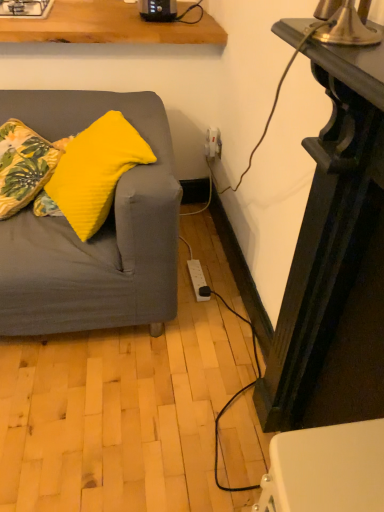
Question: Does yellow fabric pillow at left, marked as the 2th pillow in a right-to-left arrangement, have a greater width compared to yellow fabric pillow at left, the 1th pillow when ordered from right to left?

Choices:
 (A) yes
 (B) no

Answer: (B)

Question: Is yellow fabric pillow at left, marked as the 2th pillow in a right-to-left arrangement, next to yellow fabric pillow at left, the 1th pillow when ordered from right to left, and touching it?

Choices:
 (A) yes
 (B) no

Answer: (B)

Question: Considering the relative sizes of yellow fabric pillow at left, marked as the 2th pillow in a right-to-left arrangement, and yellow fabric pillow at left, which appears as the 2th pillow when viewed from the left, in the image provided, is yellow fabric pillow at left, marked as the 2th pillow in a right-to-left arrangement, smaller than yellow fabric pillow at left, which appears as the 2th pillow when viewed from the left,?

Choices:
 (A) no
 (B) yes

Answer: (B)

Question: Is yellow fabric pillow at left, marked as the 1th pillow in a left-to-right arrangement, bigger than yellow fabric pillow at left, the 1th pillow when ordered from right to left?

Choices:
 (A) no
 (B) yes

Answer: (A)

Question: Considering the relative sizes of yellow fabric pillow at left, marked as the 1th pillow in a left-to-right arrangement, and yellow fabric pillow at left, the 1th pillow when ordered from right to left, in the image provided, is yellow fabric pillow at left, marked as the 1th pillow in a left-to-right arrangement, taller than yellow fabric pillow at left, the 1th pillow when ordered from right to left,?

Choices:
 (A) no
 (B) yes

Answer: (A)

Question: Considering the relative positions of yellow fabric pillow at left, marked as the 2th pillow in a right-to-left arrangement, and yellow fabric pillow at left, which appears as the 2th pillow when viewed from the left, in the image provided, is yellow fabric pillow at left, marked as the 2th pillow in a right-to-left arrangement, behind yellow fabric pillow at left, which appears as the 2th pillow when viewed from the left,?

Choices:
 (A) no
 (B) yes

Answer: (B)

Question: Does yellow fabric pillow at left, the 1th pillow when ordered from right to left, come behind yellow fabric pillow at left, marked as the 2th pillow in a right-to-left arrangement?

Choices:
 (A) yes
 (B) no

Answer: (B)

Question: Does yellow fabric pillow at left, the 1th pillow when ordered from right to left, touch yellow fabric pillow at left, marked as the 2th pillow in a right-to-left arrangement?

Choices:
 (A) no
 (B) yes

Answer: (A)

Question: From a real-world perspective, is yellow fabric pillow at left, the 1th pillow when ordered from right to left, below yellow fabric pillow at left, marked as the 2th pillow in a right-to-left arrangement?

Choices:
 (A) yes
 (B) no

Answer: (B)

Question: Can you confirm if yellow fabric pillow at left, which appears as the 2th pillow when viewed from the left, is positioned to the left of yellow fabric pillow at left, marked as the 2th pillow in a right-to-left arrangement?

Choices:
 (A) no
 (B) yes

Answer: (A)

Question: Is yellow fabric pillow at left, which appears as the 2th pillow when viewed from the left, bigger than yellow fabric pillow at left, marked as the 2th pillow in a right-to-left arrangement?

Choices:
 (A) yes
 (B) no

Answer: (A)

Question: Can you confirm if yellow fabric pillow at left, which appears as the 2th pillow when viewed from the left, is wider than yellow fabric pillow at left, marked as the 1th pillow in a left-to-right arrangement?

Choices:
 (A) yes
 (B) no

Answer: (A)

Question: Is white glossy gas stove at upper left bigger than yellow fabric pillow at left, marked as the 2th pillow in a right-to-left arrangement?

Choices:
 (A) no
 (B) yes

Answer: (A)